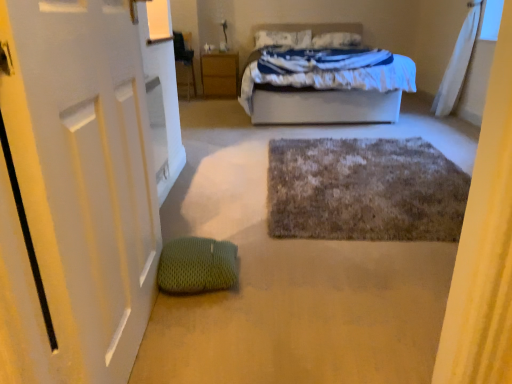
Find the location of a particular element. free space that is in between white matte door at left and green textured bean bag at lower left is located at coordinates (188, 329).